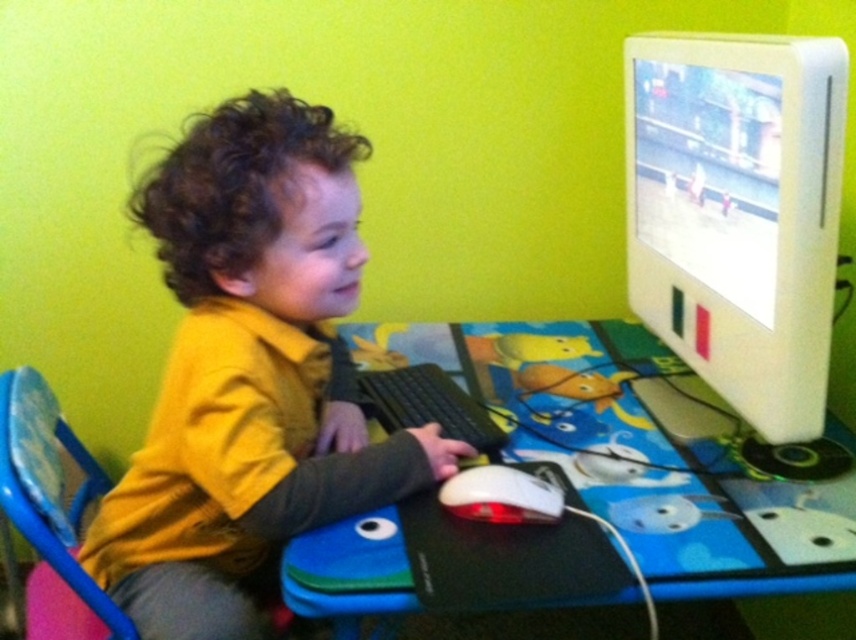
You are standing in front of the desk and want to place a new sticker exactly at the point marked as point (635, 456). According to the scene description, where on the desk should you place the sticker?

The point (635, 456) corresponds to the blue plastic computer desk at center, so you should place the sticker on the blue plastic computer desk at center.

You are a parent trying to adjust the desk setup for your child. You want to place a new lamp between the white plastic monitor at upper right and the black plastic keyboard at center. Can you tell me which side of the keyboard the monitor is on so I can position the lamp correctly?

The white plastic monitor at upper right is closer to the viewer than the black plastic keyboard at center, so the monitor is in front of the keyboard. To place the lamp between them, position it in front of the keyboard towards the monitor side.

You are a parent trying to set up a computer station for your child. The desk and monitor must be positioned so that the distance between them is exactly 12 inches to meet ergonomic guidelines. Based on the image, is the current distance between the blue plastic computer desk at center and the white plastic monitor at upper right compliant with the requirement?

The distance between the blue plastic computer desk at center and the white plastic monitor at upper right is 11.89 inches, which is slightly less than the required 12 inches. Therefore, it does not fully comply with the ergonomic guidelines.